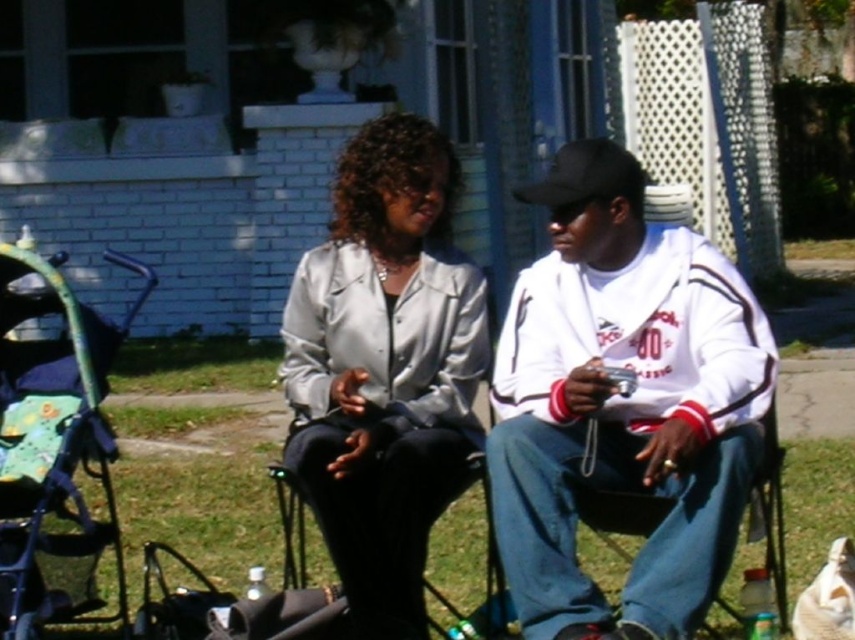
Question: Which object is the closest to the satin silver jacket at center?

Choices:
 (A) white fleece jacket at center
 (B) green plastic baby carriage at left

Answer: (A)

Question: Which object is closer to the camera taking this photo?

Choices:
 (A) green plastic baby carriage at left
 (B) white fleece jacket at center

Answer: (A)

Question: Can you confirm if satin silver jacket at center is positioned above green plastic baby carriage at left?

Choices:
 (A) no
 (B) yes

Answer: (B)

Question: Is satin silver jacket at center to the left of green plastic baby carriage at left from the viewer's perspective?

Choices:
 (A) no
 (B) yes

Answer: (A)

Question: Where is white fleece jacket at center located in relation to satin silver jacket at center in the image?

Choices:
 (A) left
 (B) right

Answer: (B)

Question: Which object is positioned closest to the white fleece jacket at center?

Choices:
 (A) satin silver jacket at center
 (B) green plastic baby carriage at left

Answer: (A)